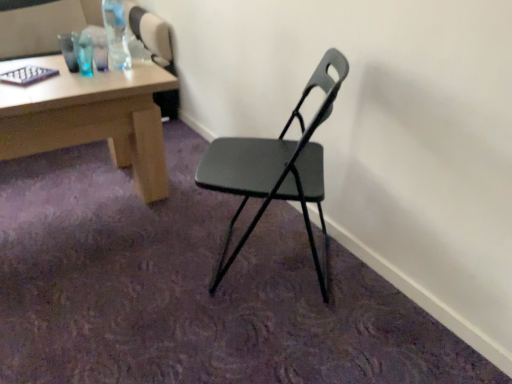
Identify the location of vacant location below matte black chair at center (from a real-world perspective). (x=258, y=258).